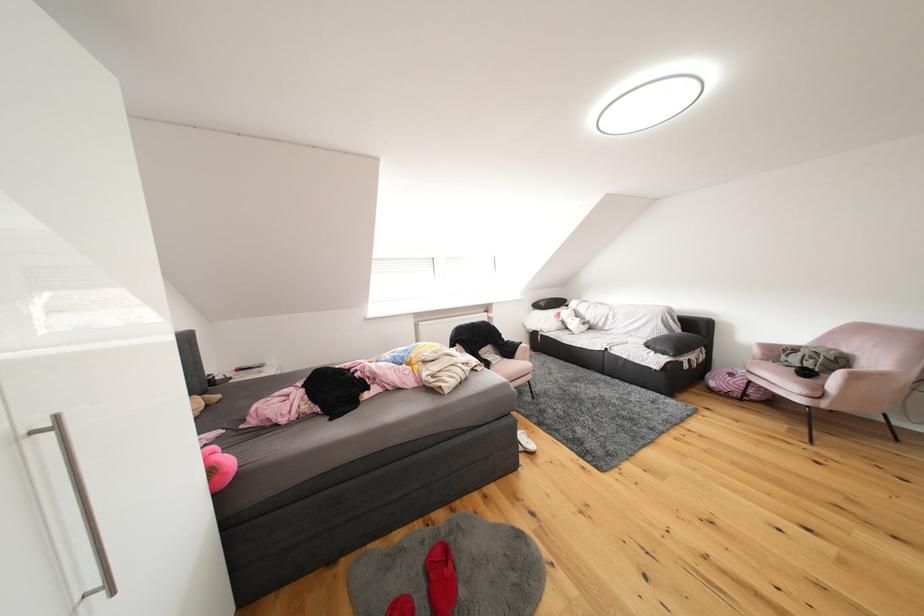
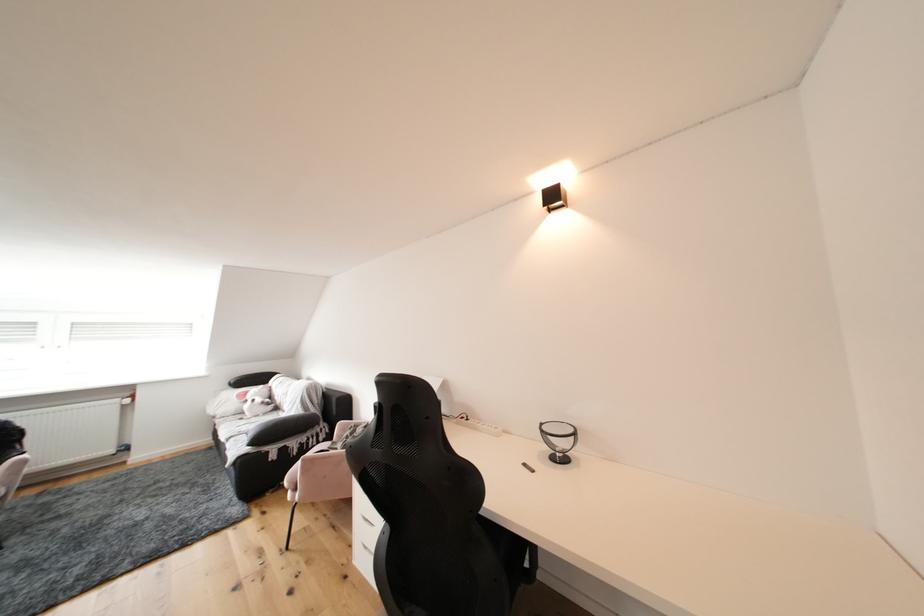
Find the pixel in the second image that matches (568,318) in the first image.

(256, 397)